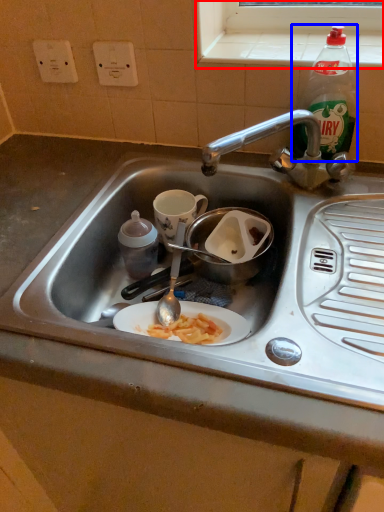
Question: Which object appears farthest to the camera in this image, window sill (highlighted by a red box) or bottle (highlighted by a blue box)?

Choices:
 (A) window sill
 (B) bottle

Answer: (A)